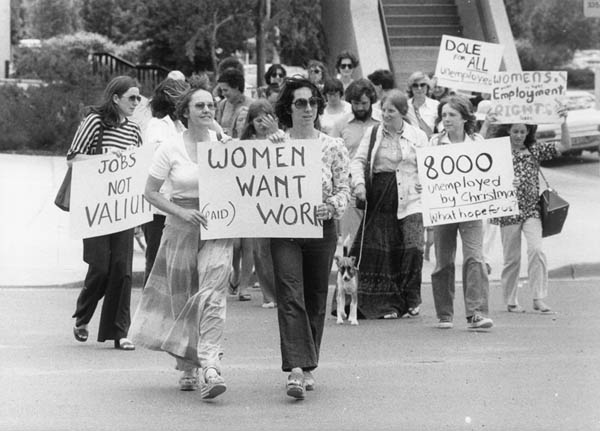
Find the location of a particular element. dark railing, center left side is located at coordinates (155, 65), (105, 48).